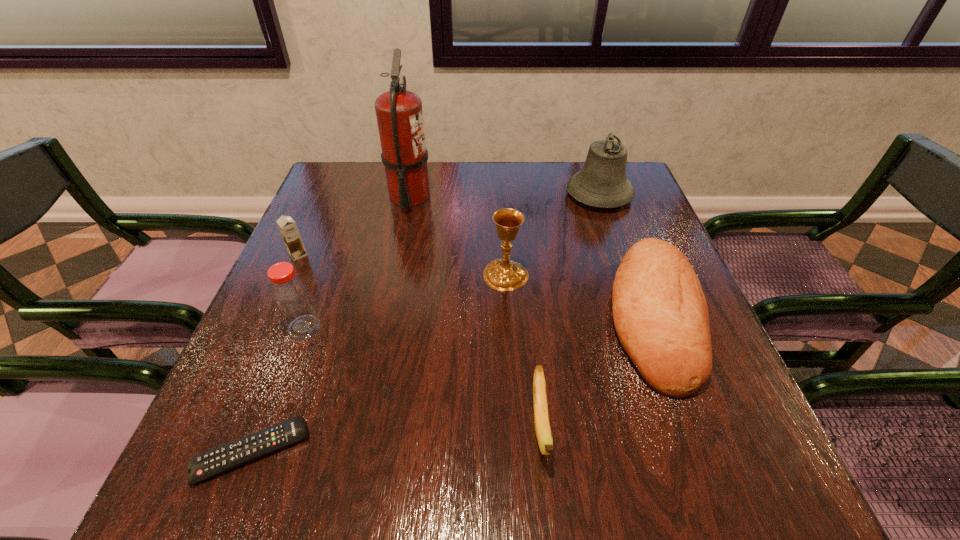
Image resolution: width=960 pixels, height=540 pixels. In order to click on fire extinguisher in this screenshot , I will do `click(399, 114)`.

Where is `the fifth object from right to left`? The image size is (960, 540). the fifth object from right to left is located at coordinates (399, 114).

Where is `bell`? bell is located at coordinates (602, 182).

This screenshot has width=960, height=540. In order to click on chalice in this screenshot , I will do `click(504, 274)`.

Locate an element on the screen. This screenshot has width=960, height=540. bottle is located at coordinates coord(291,297).

Locate an element on the screen. chocolate milk is located at coordinates 287,226.

Image resolution: width=960 pixels, height=540 pixels. Identify the location of bread. (660, 313).

The image size is (960, 540). In order to click on banana in this screenshot , I will do `click(541, 416)`.

You are a GUI agent. You are given a task and a screenshot of the screen. Output one action in this format:
    pyautogui.click(x=<x>, y=<y>)
    Task: Click on the shortest object
    
    Given the screenshot: What is the action you would take?
    pyautogui.click(x=225, y=457)

Image resolution: width=960 pixels, height=540 pixels. What are the coordinates of `vacant space located 0.180m toward the nozzle of the fifth object from right to left` in the screenshot? It's located at (495, 197).